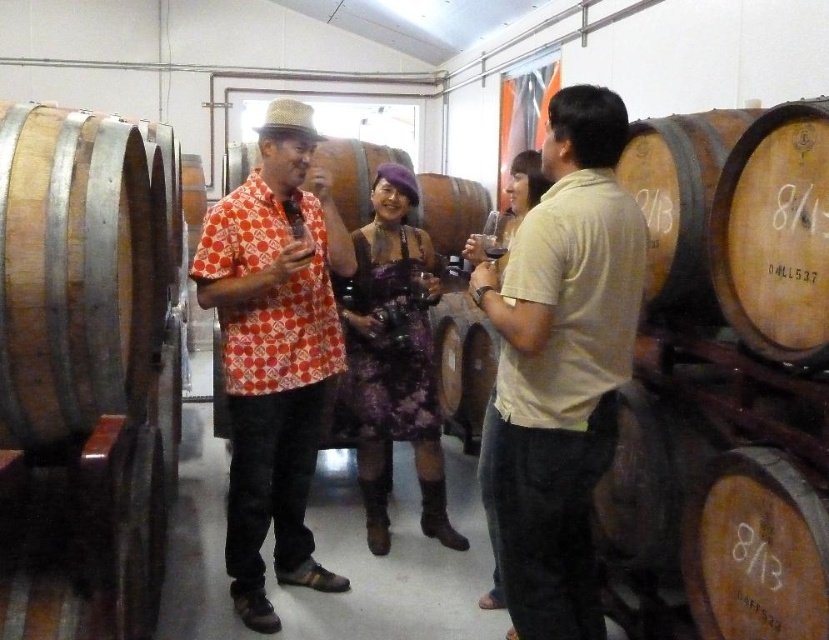
Question: Does beige cotton shirt at center have a greater width compared to purple lace dress at center?

Choices:
 (A) yes
 (B) no

Answer: (B)

Question: Which point is closer to the camera taking this photo?

Choices:
 (A) (631, 330)
 (B) (376, 364)
 (C) (297, 504)

Answer: (A)

Question: Considering the relative positions of printed cotton shirt at center and dark glass wine at center in the image provided, where is printed cotton shirt at center located with respect to dark glass wine at center?

Choices:
 (A) right
 (B) left

Answer: (B)

Question: Which object appears closest to the camera in this image?

Choices:
 (A) purple lace dress at center
 (B) printed cotton shirt at center
 (C) beige cotton shirt at center

Answer: (C)

Question: Which point is farther to the camera?

Choices:
 (A) printed cotton shirt at center
 (B) beige cotton shirt at center
 (C) dark glass wine at center
 (D) purple lace dress at center

Answer: (D)

Question: Considering the relative positions of printed cotton shirt at center and purple lace dress at center in the image provided, where is printed cotton shirt at center located with respect to purple lace dress at center?

Choices:
 (A) left
 (B) right

Answer: (A)